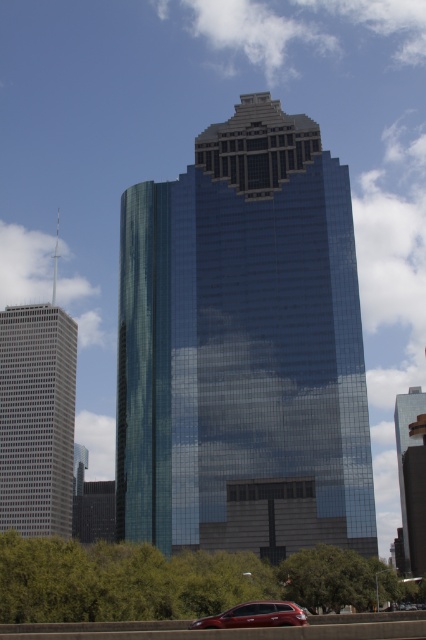
Question: Which of the following is the closest to the observer?

Choices:
 (A) shiny glass skyscraper at center
 (B) shiny metallic car at lower center
 (C) gray glass skyscraper at left
 (D) shiny glass skyscraper at right

Answer: (B)

Question: Which object appears closest to the camera in this image?

Choices:
 (A) gray glass skyscraper at left
 (B) shiny metallic car at lower center
 (C) shiny glass skyscraper at center

Answer: (B)

Question: Is gray glass skyscraper at left positioned behind shiny metallic car at lower center?

Choices:
 (A) no
 (B) yes

Answer: (B)

Question: From the image, what is the correct spatial relationship of gray glass skyscraper at left in relation to shiny glass skyscraper at right?

Choices:
 (A) left
 (B) right

Answer: (A)

Question: Does shiny glass skyscraper at center appear over gray glass skyscraper at left?

Choices:
 (A) yes
 (B) no

Answer: (A)

Question: Which object is farther from the camera taking this photo?

Choices:
 (A) shiny metallic car at lower center
 (B) shiny glass skyscraper at center
 (C) shiny glass skyscraper at right
 (D) gray glass skyscraper at left

Answer: (C)